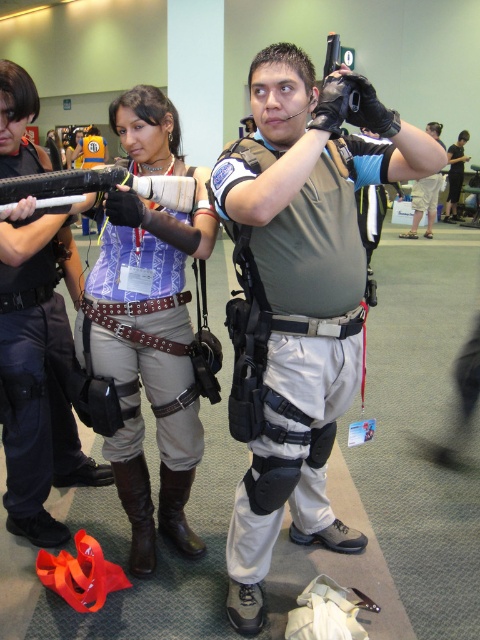
Question: Does matte black gun at upper left appear on the right side of matte black gun at center?

Choices:
 (A) yes
 (B) no

Answer: (B)

Question: Estimate the real-world distances between objects in this image. Which object is closer to the matte black gun at center?

Choices:
 (A) matte black gun at upper left
 (B) black matte gun at center
 (C) matte black boots at lower right

Answer: (C)

Question: Based on their relative distances, which object is nearer to the matte black boots at lower right?

Choices:
 (A) black leather gloves at upper center
 (B) matte black tactical vest at center
 (C) matte purple shirt at center

Answer: (A)

Question: Which point is closer to the camera?

Choices:
 (A) (252, 445)
 (B) (132, 435)
 (C) (463, 147)

Answer: (A)

Question: Can you confirm if matte black gun at upper left is positioned to the right of black leather gloves at upper center?

Choices:
 (A) yes
 (B) no

Answer: (B)

Question: Can you confirm if matte purple shirt at center is positioned above black matte gun at center?

Choices:
 (A) yes
 (B) no

Answer: (B)